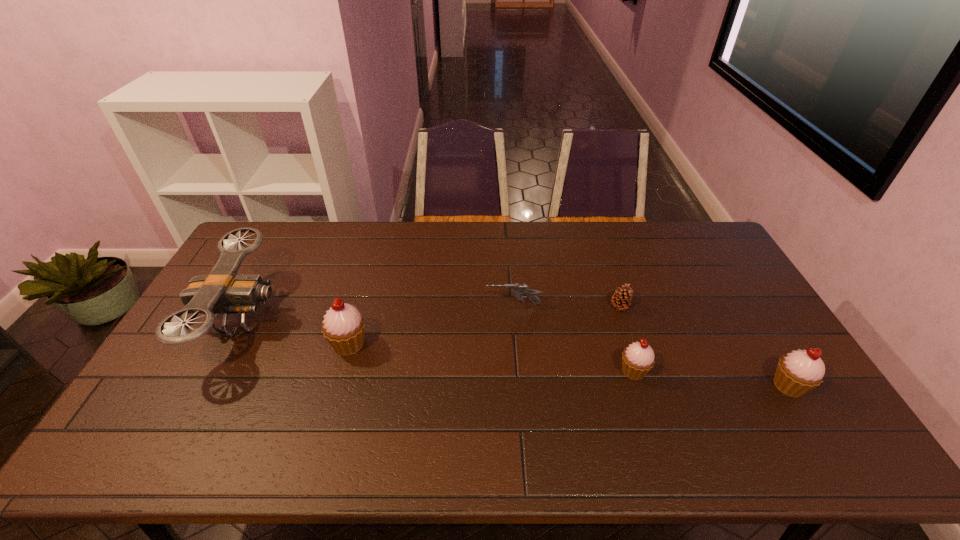
In the image, there is a desktop. Where is `vacant space at the far edge`? The height and width of the screenshot is (540, 960). vacant space at the far edge is located at coordinates (630, 251).

Find the location of `vacant space at the near edge of the desktop`. vacant space at the near edge of the desktop is located at coordinates (375, 419).

In the image, there is a desktop. Identify the location of free space at the far left corner. This screenshot has width=960, height=540. (284, 242).

The width and height of the screenshot is (960, 540). In order to click on vacant space at the far right corner in this screenshot , I will do `click(690, 250)`.

You are a GUI agent. You are given a task and a screenshot of the screen. Output one action in this format:
    pyautogui.click(x=<x>, y=<y>)
    Task: Click on the vacant space at the near right corner of the desktop
    Image resolution: width=960 pixels, height=540 pixels.
    Given the screenshot: What is the action you would take?
    pyautogui.click(x=798, y=404)

Image resolution: width=960 pixels, height=540 pixels. Find the location of `unoccupied area between the pinecone and the leftmost object`. unoccupied area between the pinecone and the leftmost object is located at coordinates (431, 313).

I want to click on free space between the second cupcake from left to right and the gun, so click(x=573, y=338).

The width and height of the screenshot is (960, 540). Find the location of `vacant space that is in between the pinecone and the second object from left to right`. vacant space that is in between the pinecone and the second object from left to right is located at coordinates (484, 325).

Where is `vacant region between the pinecone and the second object from left to right`? vacant region between the pinecone and the second object from left to right is located at coordinates (484, 325).

Locate an element on the screen. Image resolution: width=960 pixels, height=540 pixels. vacant space that is in between the second object from left to right and the drone is located at coordinates (296, 331).